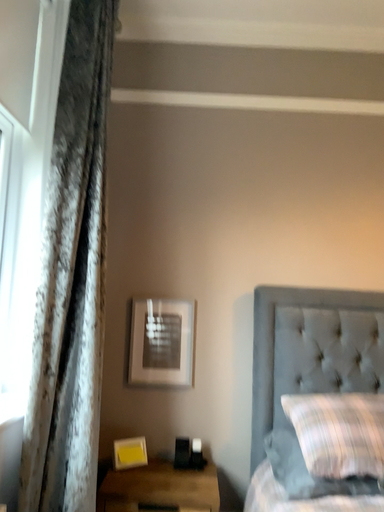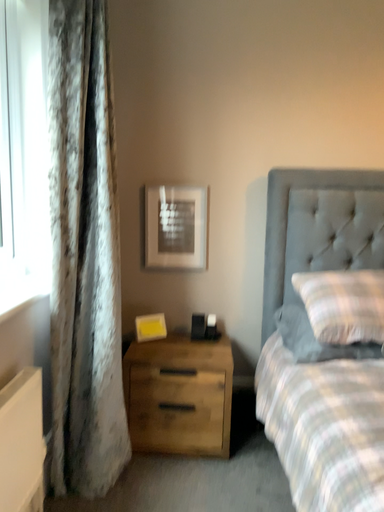
Question: How did the camera likely rotate when shooting the video?

Choices:
 (A) rotated upward
 (B) rotated downward

Answer: (B)